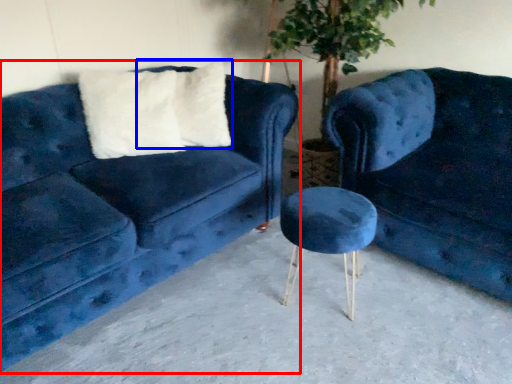
Question: Which of the following is the closest to the observer, studio couch (highlighted by a red box) or pillow (highlighted by a blue box)?

Choices:
 (A) studio couch
 (B) pillow

Answer: (A)